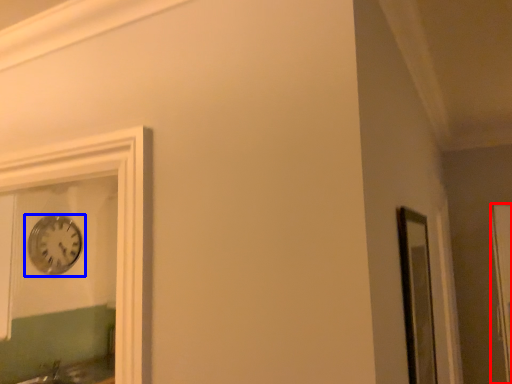
Question: Which of the following is the closest to the observer, glass door (highlighted by a red box) or wall clock (highlighted by a blue box)?

Choices:
 (A) glass door
 (B) wall clock

Answer: (A)